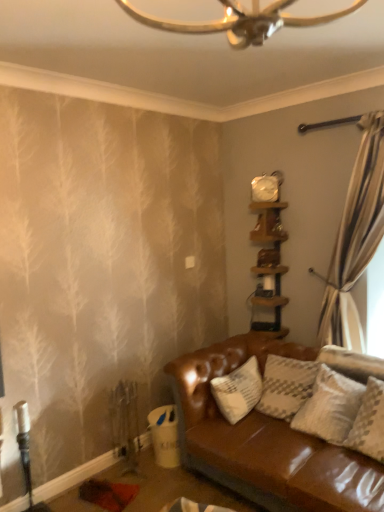
Question: From a real-world perspective, is wooden shelf at upper right, placed as the 2th shelf when sorted from top to bottom, positioned over white glossy clock at upper center based on gravity?

Choices:
 (A) yes
 (B) no

Answer: (B)

Question: Can you confirm if wooden shelf at upper right, placed as the 2th shelf when sorted from top to bottom, is smaller than white glossy clock at upper center?

Choices:
 (A) yes
 (B) no

Answer: (B)

Question: Is wooden shelf at upper right, placed as the 2th shelf when sorted from top to bottom, surrounding white glossy clock at upper center?

Choices:
 (A) no
 (B) yes

Answer: (A)

Question: Considering the relative sizes of wooden shelf at upper right, which is the first shelf from bottom to top, and white glossy clock at upper center in the image provided, is wooden shelf at upper right, which is the first shelf from bottom to top, shorter than white glossy clock at upper center?

Choices:
 (A) no
 (B) yes

Answer: (A)

Question: From a real-world perspective, is wooden shelf at upper right, which is the first shelf from bottom to top, below white glossy clock at upper center?

Choices:
 (A) yes
 (B) no

Answer: (A)

Question: Looking at the image, does white glossy clock at upper center seem bigger or smaller compared to wooden shelf at upper right, the 1th shelf from the top?

Choices:
 (A) small
 (B) big

Answer: (A)

Question: From a real-world perspective, is white glossy clock at upper center above or below wooden shelf at upper right, the second shelf positioned from the bottom?

Choices:
 (A) above
 (B) below

Answer: (A)

Question: From the image's perspective, relative to wooden shelf at upper right, the 1th shelf from the top, is white glossy clock at upper center above or below?

Choices:
 (A) below
 (B) above

Answer: (B)

Question: Considering the positions of point (266, 201) and point (281, 238), is point (266, 201) closer or farther from the camera than point (281, 238)?

Choices:
 (A) farther
 (B) closer

Answer: (B)

Question: From the image's perspective, is white glossy clock at upper center located above or below wooden shelf at upper right, placed as the 2th shelf when sorted from top to bottom?

Choices:
 (A) below
 (B) above

Answer: (B)

Question: Based on their positions, is white glossy clock at upper center located to the left or right of wooden shelf at upper right, which is the first shelf from bottom to top?

Choices:
 (A) left
 (B) right

Answer: (A)

Question: In terms of height, does white glossy clock at upper center look taller or shorter compared to wooden shelf at upper right, which is the first shelf from bottom to top?

Choices:
 (A) short
 (B) tall

Answer: (A)

Question: Would you say white glossy clock at upper center is inside or outside wooden shelf at upper right, which is the first shelf from bottom to top?

Choices:
 (A) outside
 (B) inside

Answer: (A)

Question: Considering the positions of wooden shelf at upper right, which is the first shelf from bottom to top, and wooden shelf at upper right, the 1th shelf from the top, in the image, is wooden shelf at upper right, which is the first shelf from bottom to top, taller or shorter than wooden shelf at upper right, the 1th shelf from the top,?

Choices:
 (A) short
 (B) tall

Answer: (B)

Question: Is point (256, 297) closer or farther from the camera than point (276, 210)?

Choices:
 (A) farther
 (B) closer

Answer: (A)